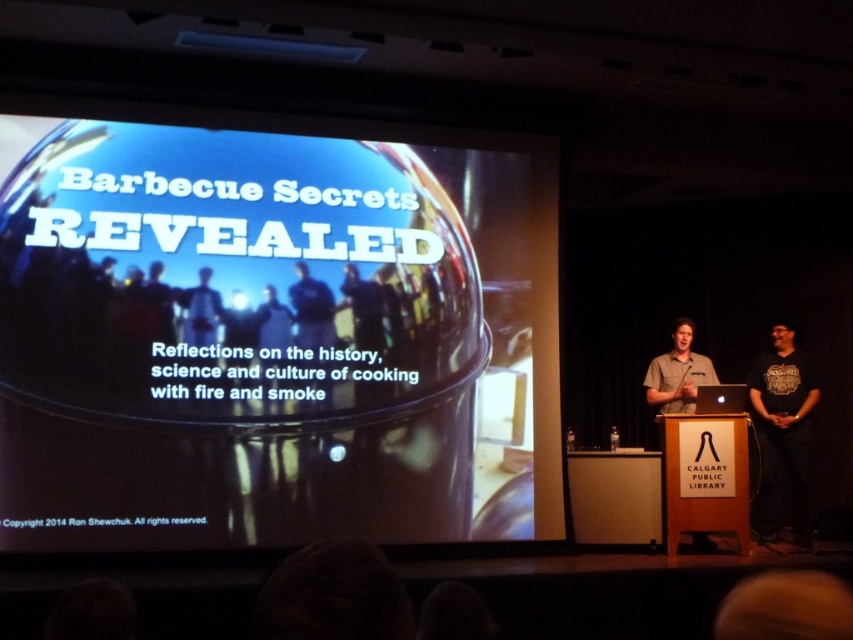
Consider the image. You are a photographer in the audience of this presentation. You want to take a photo of the matte black barbecue grill at center and the matte black shirt at center. The camera you are using has a minimum focus distance of 30 inches. Will you be able to capture both objects clearly in focus without moving closer?

The distance between the matte black barbecue grill at center and the matte black shirt at center is 28.63 inches, which is less than the camera minimum focus distance of 30 inches. Therefore, you will not be able to capture both objects clearly in focus without moving closer.

Consider the image. You are an attendee at the presentation and you want to know which object is closer to the bottom of the screen between the matte black barbecue grill at center and the matte black shirt at center. Based on the scene description, can you determine this?

The matte black barbecue grill at center is below the matte black shirt at center, so the barbecue grill is closer to the bottom of the screen.